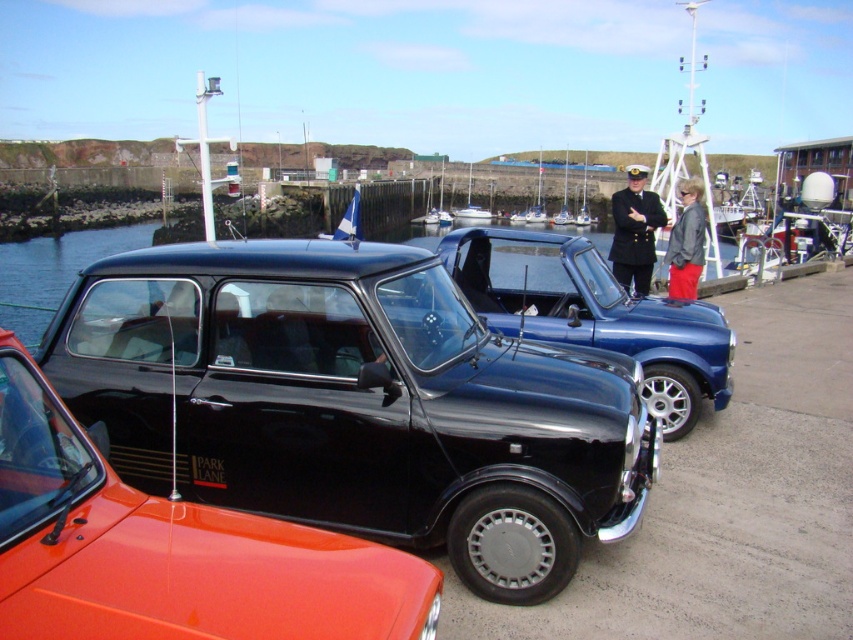
Is the position of black glossy car at center more distant than that of white glossy boat at center?

No.

Does black glossy car at center appear under white glossy boat at center?

Yes.

Find the location of a particular element. black glossy car at center is located at coordinates (355, 403).

Which is behind, point (184, 525) or point (689, 412)?

The point (689, 412) is more distant.

Does glossy black car at center have a greater height compared to glossy blue car at center?

In fact, glossy black car at center may be shorter than glossy blue car at center.

Between point (424, 564) and point (587, 260), which one is positioned behind?

Point (587, 260)

Image resolution: width=853 pixels, height=640 pixels. Identify the location of glossy black car at center. (170, 550).

At what (x,y) coordinates should I click in order to perform the action: click on black glossy car at center. Please return your answer as a coordinate pair (x, y). The width and height of the screenshot is (853, 640). Looking at the image, I should click on (355, 403).